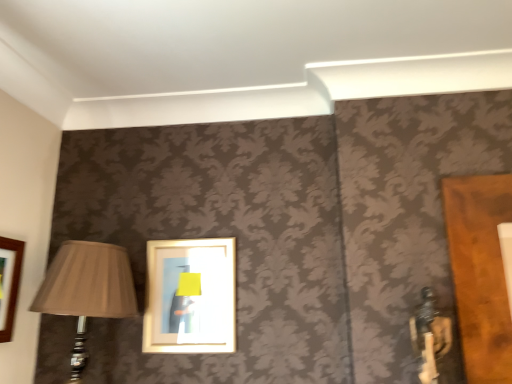
Question: Could you tell me if matte brown lampshade at left is turned towards wooden frame at center?

Choices:
 (A) no
 (B) yes

Answer: (A)

Question: Is matte brown lampshade at left wider than wooden frame at center?

Choices:
 (A) yes
 (B) no

Answer: (A)

Question: Does matte brown lampshade at left have a lesser height compared to wooden frame at center?

Choices:
 (A) no
 (B) yes

Answer: (A)

Question: Does matte brown lampshade at left have a smaller size compared to wooden frame at center?

Choices:
 (A) no
 (B) yes

Answer: (A)

Question: From the image's perspective, would you say matte brown lampshade at left is shown under wooden frame at center?

Choices:
 (A) no
 (B) yes

Answer: (B)

Question: Considering the relative positions of matte brown lampshade at left and wooden frame at center in the image provided, is matte brown lampshade at left to the left of wooden frame at center from the viewer's perspective?

Choices:
 (A) yes
 (B) no

Answer: (A)

Question: Does wooden frame at center have a smaller size compared to matte brown lampshade at left?

Choices:
 (A) no
 (B) yes

Answer: (B)

Question: Is wooden frame at center facing away from matte brown lampshade at left?

Choices:
 (A) no
 (B) yes

Answer: (A)

Question: Is wooden frame at center in front of matte brown lampshade at left?

Choices:
 (A) yes
 (B) no

Answer: (B)

Question: Is wooden frame at center not close to matte brown lampshade at left?

Choices:
 (A) no
 (B) yes

Answer: (A)

Question: From a real-world perspective, is wooden frame at center positioned over matte brown lampshade at left based on gravity?

Choices:
 (A) yes
 (B) no

Answer: (A)

Question: Is wooden frame at center at the right side of matte brown lampshade at left?

Choices:
 (A) no
 (B) yes

Answer: (B)

Question: In terms of size, does matte brown lampshade at left appear bigger or smaller than wooden frame at center?

Choices:
 (A) small
 (B) big

Answer: (B)